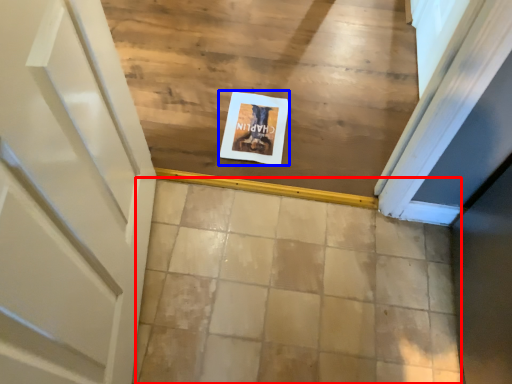
Question: Which object appears farthest to the camera in this image, tile (highlighted by a red box) or postcard (highlighted by a blue box)?

Choices:
 (A) tile
 (B) postcard

Answer: (B)